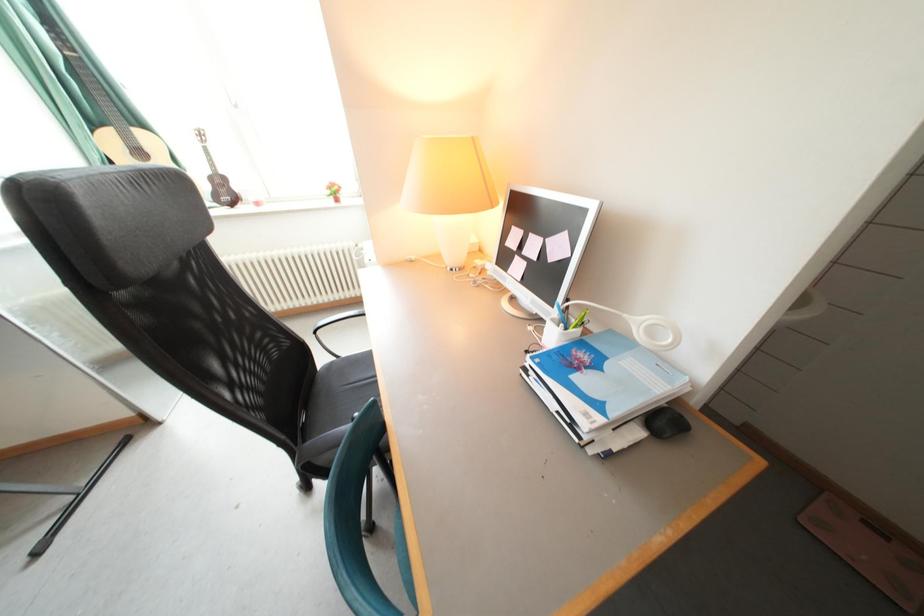
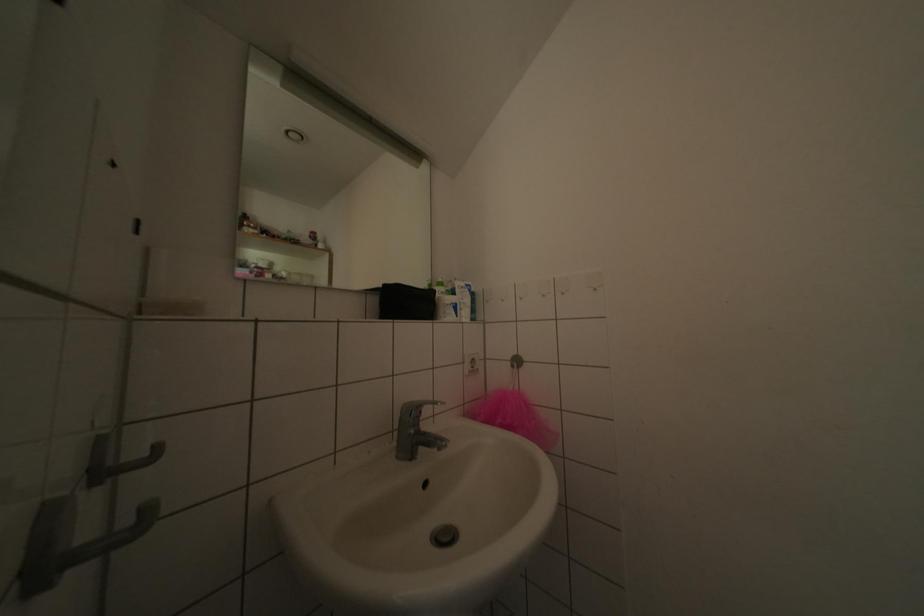
How did the camera likely rotate?

The camera's rotation is toward right-up.